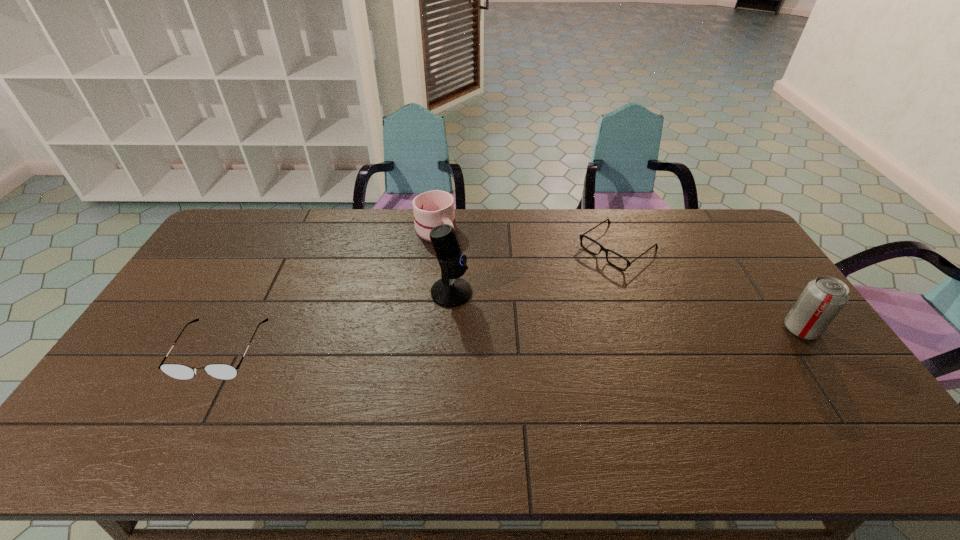
Locate an element on the screen. The height and width of the screenshot is (540, 960). vacant area that lies between the farther spectacles and the tallest object is located at coordinates (535, 270).

Find the location of a particular element. The width and height of the screenshot is (960, 540). vacant point located between the taller spectacles and the fourth shortest object is located at coordinates (511, 340).

In order to click on vacant space that's between the microphone and the fourth tallest object in this screenshot , I will do `click(336, 321)`.

Find the location of `free space that is in between the mug and the fourth shortest object`. free space that is in between the mug and the fourth shortest object is located at coordinates (618, 280).

You are a GUI agent. You are given a task and a screenshot of the screen. Output one action in this format:
    pyautogui.click(x=<x>, y=<y>)
    Task: Click on the empty location between the third farthest object and the rightmost object
    The width and height of the screenshot is (960, 540).
    Given the screenshot: What is the action you would take?
    pyautogui.click(x=626, y=311)

Where is `free spot between the nearer spectacles and the shortest object`? The height and width of the screenshot is (540, 960). free spot between the nearer spectacles and the shortest object is located at coordinates (420, 299).

Where is `vacant area between the soda can and the microphone`? vacant area between the soda can and the microphone is located at coordinates (626, 311).

Identify the location of empty location between the nearer spectacles and the mug. The image size is (960, 540). (328, 291).

Select which object is the fourth closest to the mug. Please provide its 2D coordinates. Your answer should be formatted as a tuple, i.e. [(x, y)], where the tuple contains the x and y coordinates of a point satisfying the conditions above.

[(823, 298)]

Identify which object is located as the third nearest to the mug. Please provide its 2D coordinates. Your answer should be formatted as a tuple, i.e. [(x, y)], where the tuple contains the x and y coordinates of a point satisfying the conditions above.

[(179, 371)]